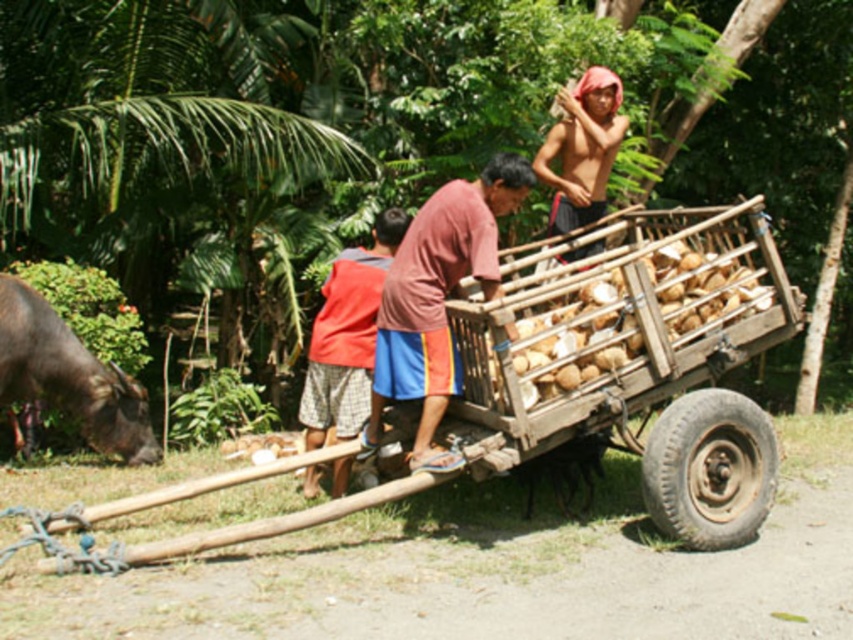
Is wooden cart at center to the right of brown wooden coconuts at center from the viewer's perspective?

Incorrect, wooden cart at center is not on the right side of brown wooden coconuts at center.

Does wooden cart at center have a lesser height compared to brown wooden coconuts at center?

Incorrect, wooden cart at center's height does not fall short of brown wooden coconuts at center's.

Which is behind, point (103, 506) or point (581, 358)?

Positioned behind is point (581, 358).

You are a GUI agent. You are given a task and a screenshot of the screen. Output one action in this format:
    pyautogui.click(x=<x>, y=<y>)
    Task: Click on the wooden cart at center
    
    Given the screenshot: What is the action you would take?
    pyautogui.click(x=637, y=362)

Is wooden cart at center bigger than brown fabric shirt at center?

Yes.

Which is above, wooden cart at center or brown fabric shirt at center?

brown fabric shirt at center is higher up.

Is point (548, 304) farther from viewer compared to point (427, 371)?

Yes, point (548, 304) is behind point (427, 371).

Find the location of a particular element. Image resolution: width=853 pixels, height=640 pixels. wooden cart at center is located at coordinates (637, 362).

Is brown rough skin bull at lower left below red fabric shirt at center?

Indeed, brown rough skin bull at lower left is positioned under red fabric shirt at center.

Can you confirm if brown rough skin bull at lower left is positioned to the right of red fabric shirt at center?

No, brown rough skin bull at lower left is not to the right of red fabric shirt at center.

Which is in front, point (51, 310) or point (318, 432)?

Positioned in front is point (318, 432).

Image resolution: width=853 pixels, height=640 pixels. What are the coordinates of `brown rough skin bull at lower left` in the screenshot? It's located at (68, 376).